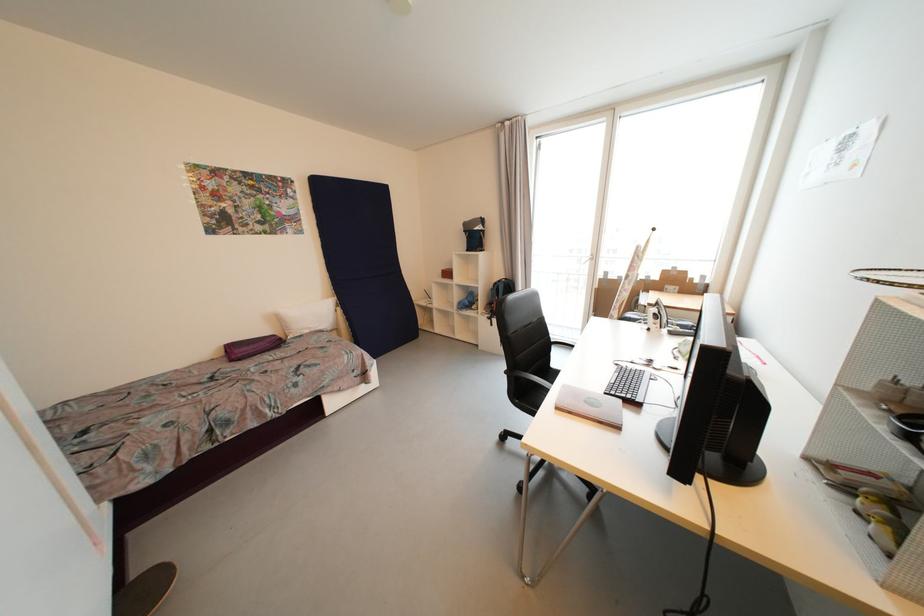
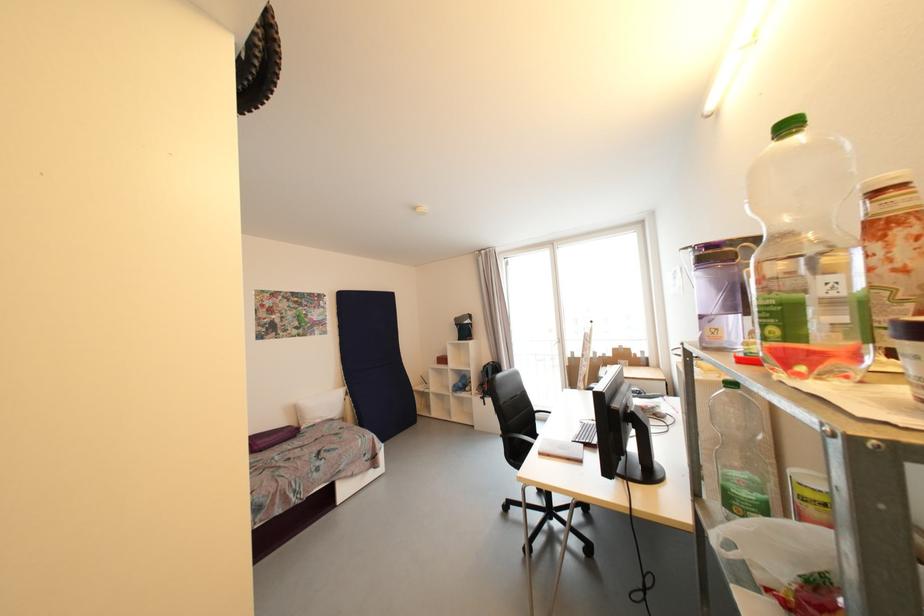
Find the pixel in the second image that matches [501,285] in the first image.

(490, 368)